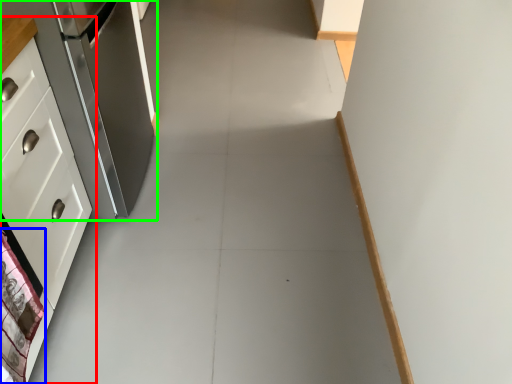
Question: Considering the real-world distances, which object is closest to cabinetry (highlighted by a red box)? material (highlighted by a blue box) or refrigerator (highlighted by a green box).

Choices:
 (A) material
 (B) refrigerator

Answer: (A)